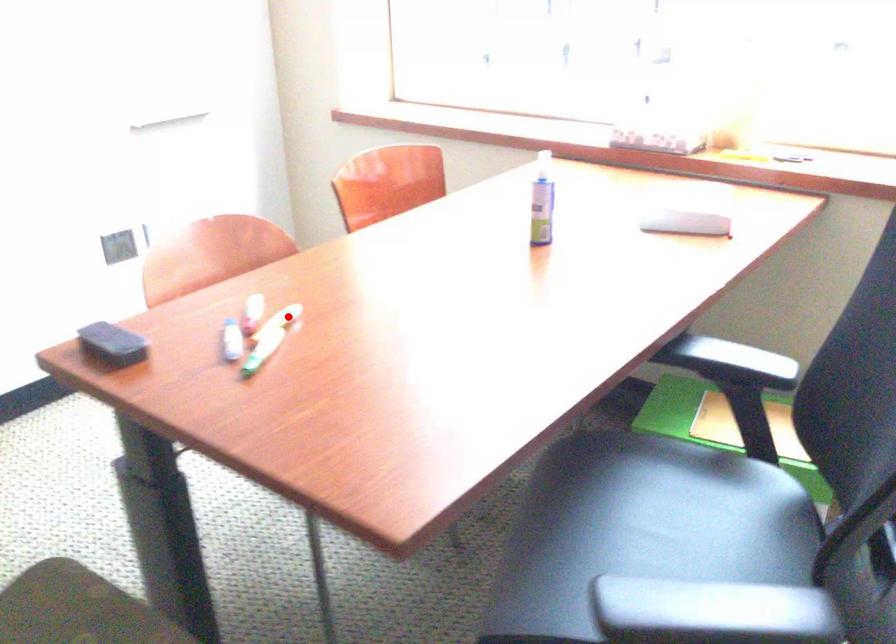
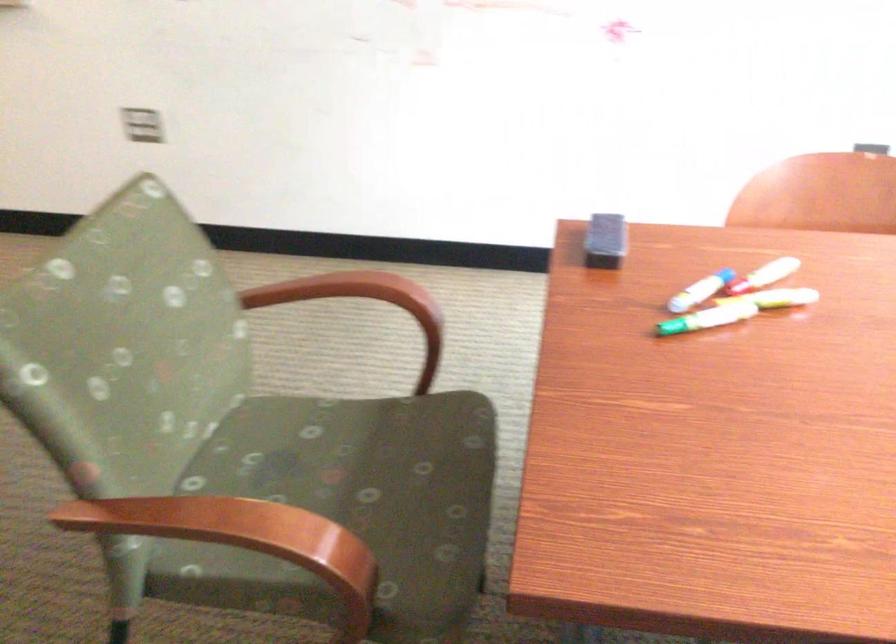
Question: A red point is marked in image1. In image2, is the corresponding 3D point closer to the camera or farther? Reply with the corresponding letter.

Choices:
 (A) The corresponding 3D point is closer.
 (B) The corresponding 3D point is farther.

Answer: (A)